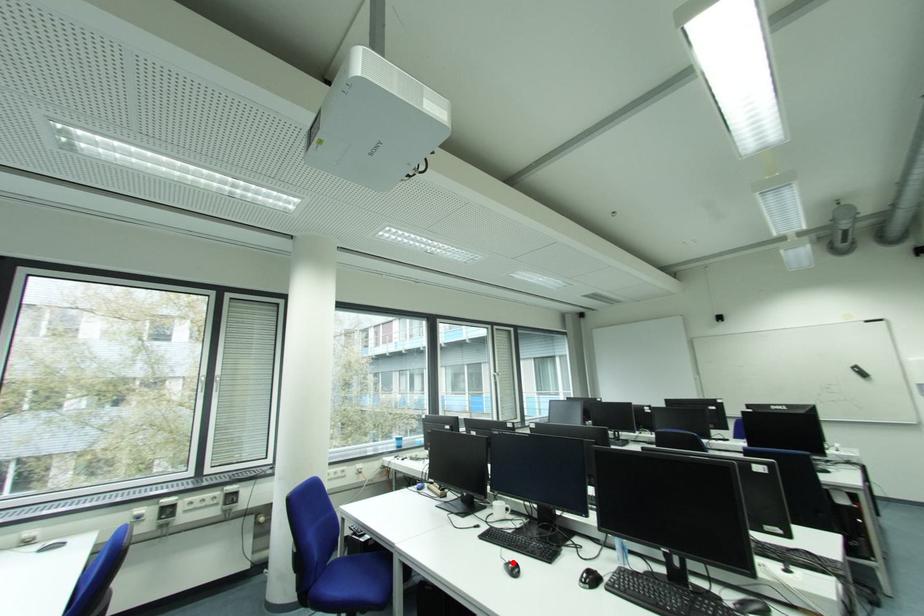
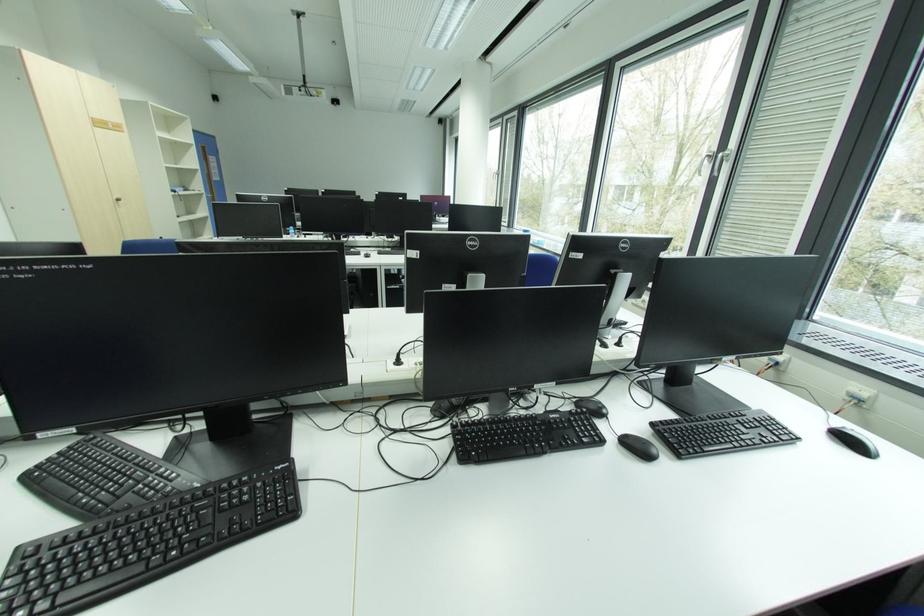
Question: I am providing you with two images of the same scene from different viewpoints. A red point is marked on the first image. Can you still see the location of the red point in image 2?

Choices:
 (A) Yes
 (B) No

Answer: (B)